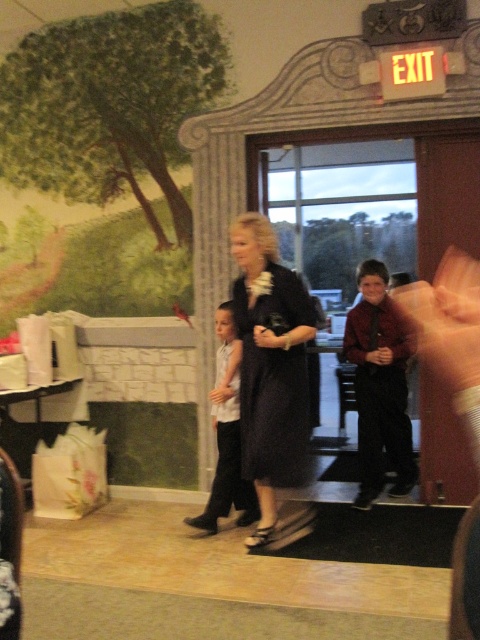
Who is taller, dark blue dress at center or white matte shirt at center?

Standing taller between the two is dark blue dress at center.

Does dark blue dress at center have a lesser height compared to white matte shirt at center?

No.

Who is more forward, (285, 310) or (228, 304)?

Point (285, 310)

The image size is (480, 640). I want to click on dark blue dress at center, so point(268,365).

Who is more distant from viewer, [358,380] or [229,349]?

The point [358,380] is behind.

Based on the photo, who is more forward, [379,360] or [228,499]?

Point [228,499]

The width and height of the screenshot is (480, 640). Describe the element at coordinates (380, 385) in the screenshot. I see `dark red shirt at right` at that location.

You are a GUI agent. You are given a task and a screenshot of the screen. Output one action in this format:
    pyautogui.click(x=<x>, y=<y>)
    Task: Click on the dark red shirt at right
    Image resolution: width=480 pixels, height=640 pixels.
    Given the screenshot: What is the action you would take?
    pyautogui.click(x=380, y=385)

What do you see at coordinates (268, 365) in the screenshot? I see `dark blue dress at center` at bounding box center [268, 365].

Is dark blue dress at center to the left of dark red shirt at right from the viewer's perspective?

Correct, you'll find dark blue dress at center to the left of dark red shirt at right.

What do you see at coordinates (268, 365) in the screenshot? This screenshot has height=640, width=480. I see `dark blue dress at center` at bounding box center [268, 365].

Find the location of a particular element. The image size is (480, 640). dark blue dress at center is located at coordinates (268, 365).